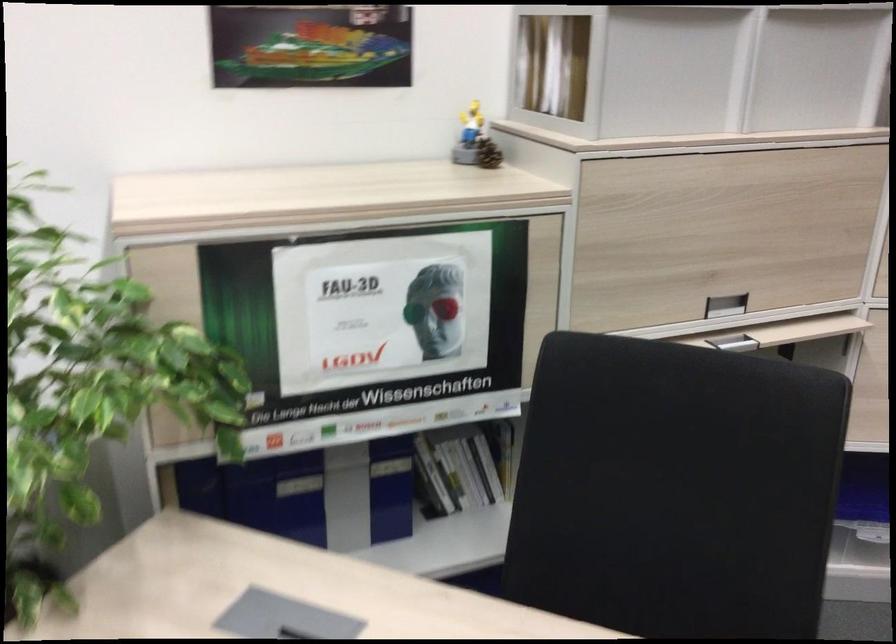
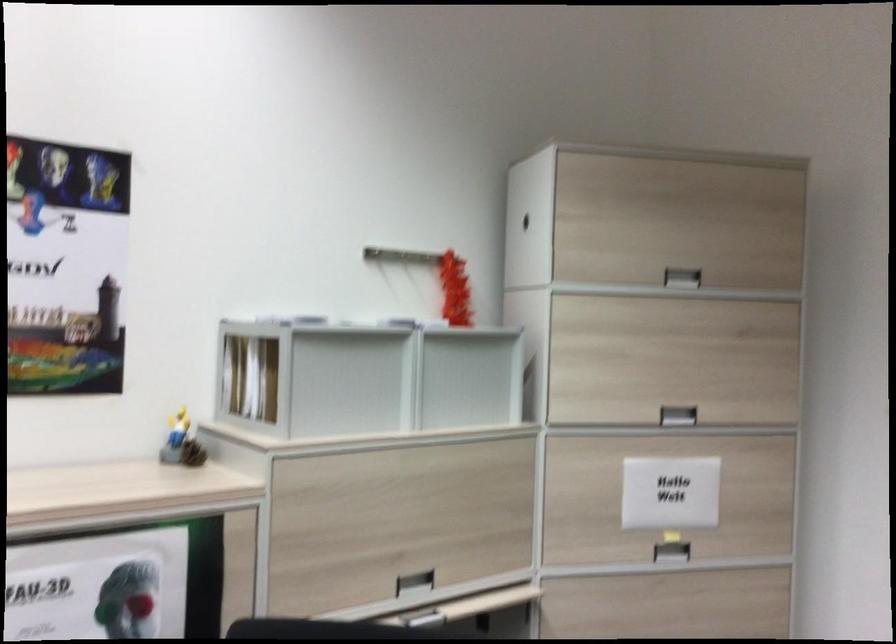
Where in the second image is the point corresponding to [721,303] from the first image?

(415, 583)